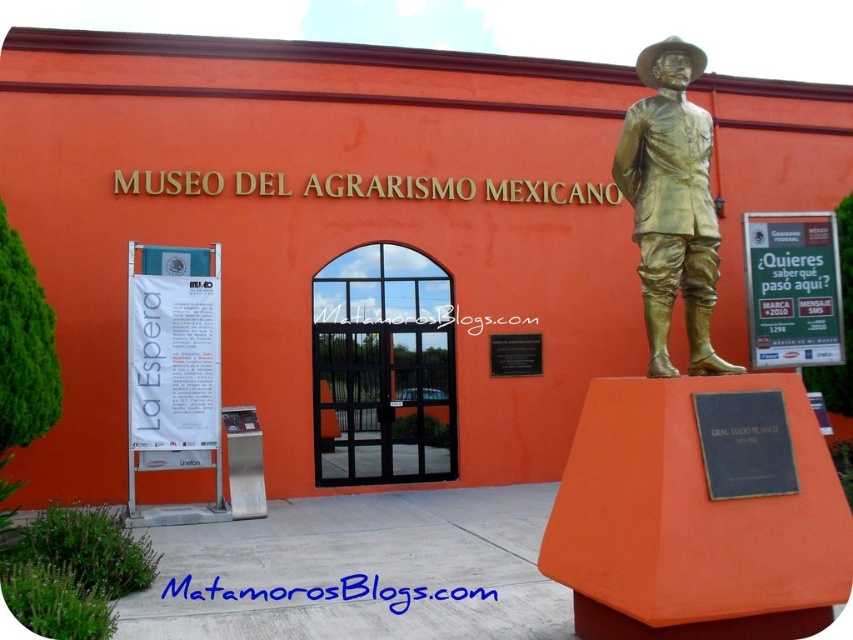
You are a tour guide explaining the museum layout to visitors. Pointing to the bronze statue at right and the black polished stone plaque at center, you want to inform them about their sizes. What do you tell them?

The bronze statue at right is taller than the black polished stone plaque at center.

You are a visitor at the Museo del Agrarismo Mexicano. You see the black glass door at center and the bronze statue at right. Which object is taller?

The black glass door at center is much taller than the bronze statue at right.